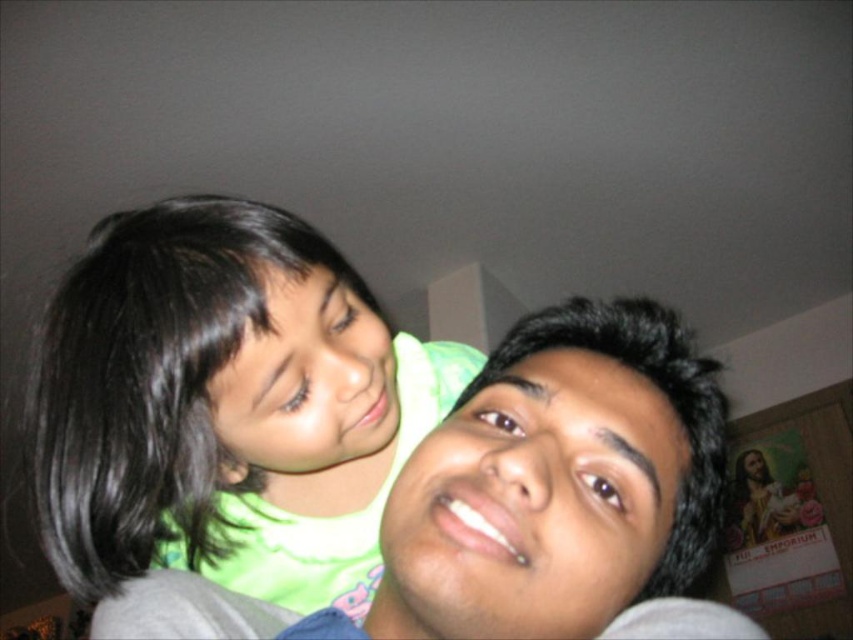
You are standing in the room and want to place a small decorative item exactly at the position where the green matte shirt at upper left is located. According to the coordinates provided, what are the coordinates where you should place the item?

The coordinates for the green matte shirt at upper left are (x=225, y=406), so you should place the item at those coordinates.

You are a photographer setting up for a family photo. You need to position two shirts on a mannequin stand so that the green matte shirt at upper left is visible above the matte gray shirt at center. Given their sizes, can you arrange them this way?

The green matte shirt at upper left is taller than matte gray shirt at center, so arranging them vertically would allow the green matte shirt at upper left to be visible above the matte gray shirt at center since it is taller.

In the scene shown: You are a photographer setting up for a family portrait. You see the green matte shirt at upper left and the matte gray shirt at center. Which shirt should you focus on if you want to capture the one higher in the frame?

The green matte shirt at upper left is located above the matte gray shirt at center, so you should focus on the green matte shirt at upper left to capture the higher one.